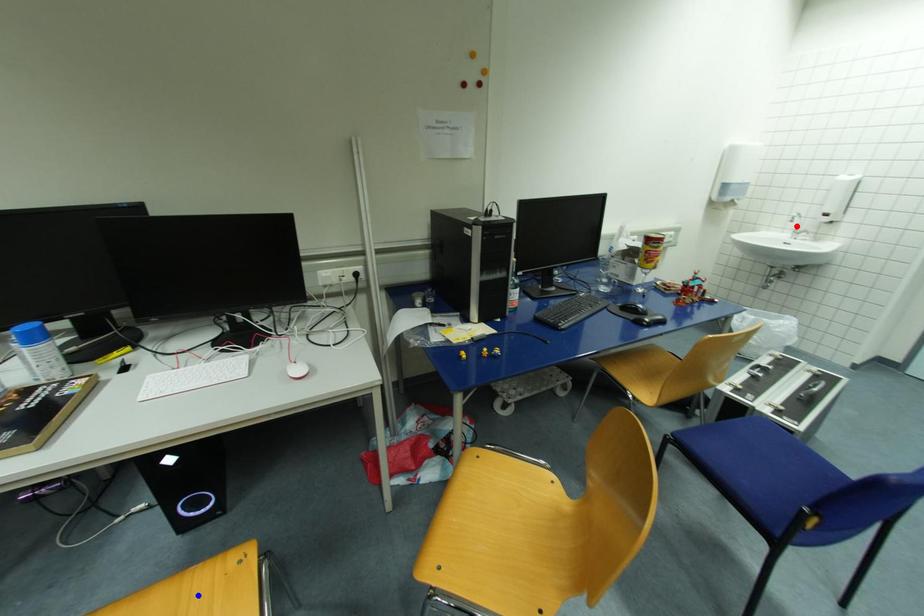
Question: Two points are marked on the image. Which point is closer to the camera?

Choices:
 (A) Blue point is closer.
 (B) Red point is closer.

Answer: (A)